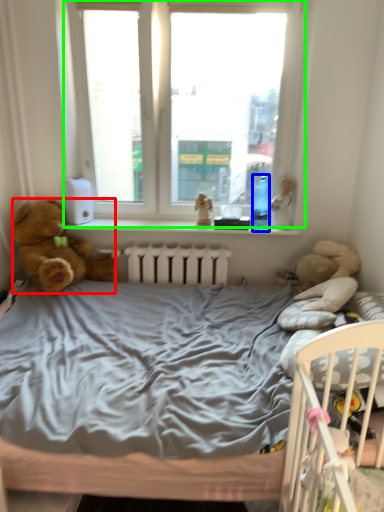
Question: Which is farther away from teddy bear (highlighted by a red box)? bottle (highlighted by a blue box) or window (highlighted by a green box)?

Choices:
 (A) bottle
 (B) window

Answer: (A)